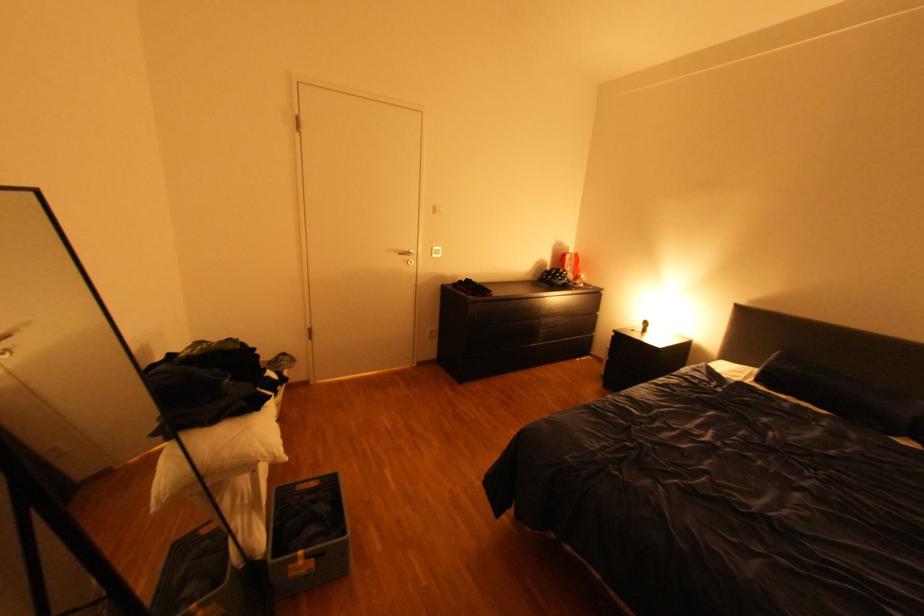
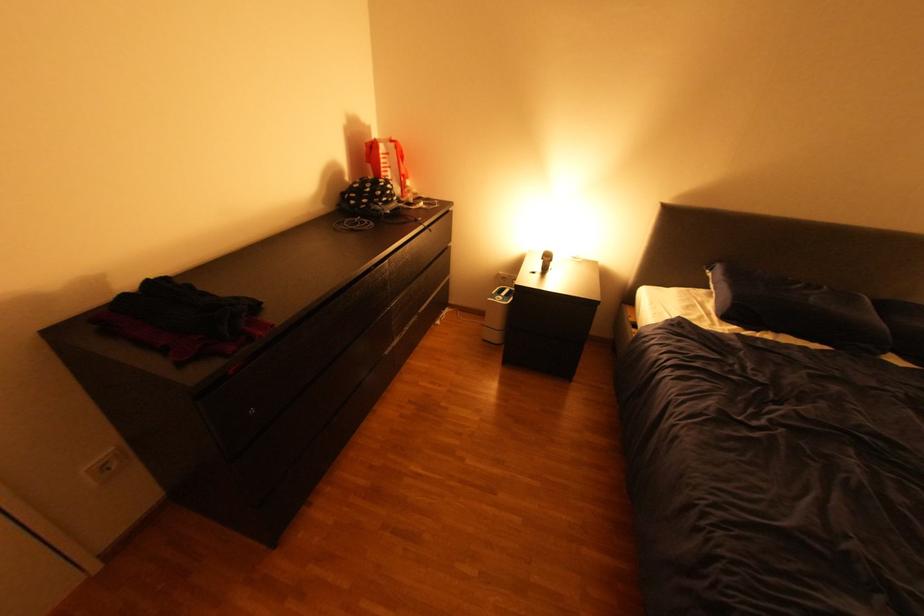
The point at [771,387] is marked in the first image. Where is the corresponding point in the second image?

(745, 326)